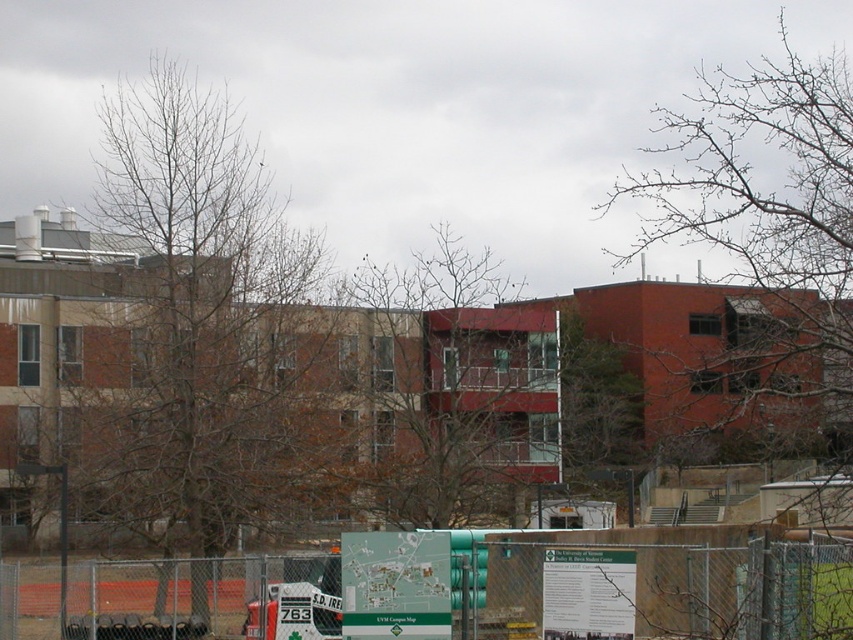
You are a visitor at the UVM campus and you see the bare branches at left and the bare branches at upper right. Which one is closer to the ground?

The bare branches at left is closer to the ground because it is positioned below the bare branches at upper right.